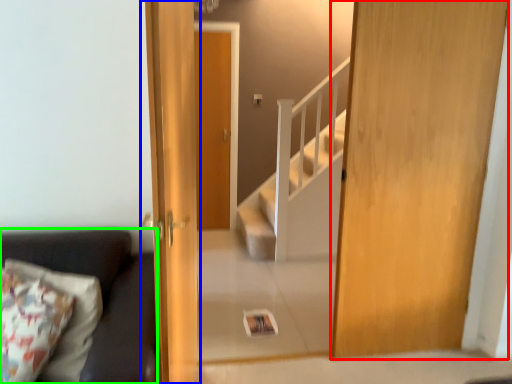
Question: Estimate the real-world distances between objects in this image. Which object is farther from door (highlighted by a red box), door (highlighted by a blue box) or studio couch (highlighted by a green box)?

Choices:
 (A) door
 (B) studio couch

Answer: (B)